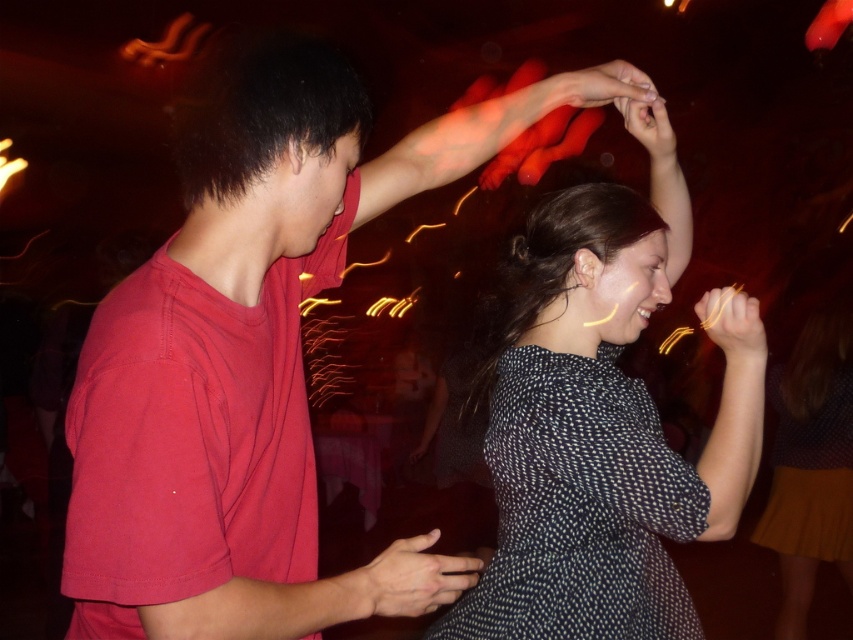
Which is in front, point (248, 468) or point (506, 564)?

Positioned in front is point (248, 468).

Does matte red t-shirt at left lie in front of dark blue dotted dress at center?

Yes, matte red t-shirt at left is in front of dark blue dotted dress at center.

Between point (183, 225) and point (641, 410), which one is positioned behind?

The point (641, 410) is behind.

This screenshot has width=853, height=640. Find the location of `matte red t-shirt at left`. matte red t-shirt at left is located at coordinates (245, 346).

Is the position of spotted fabric dress at center more distant than that of dark blue dotted dress at center?

Yes.

Between spotted fabric dress at center and dark blue dotted dress at center, which one has less height?

Standing shorter between the two is dark blue dotted dress at center.

Identify the location of spotted fabric dress at center. (601, 422).

Who is lower down, matte red t-shirt at left or matte black phone at center?

matte black phone at center

Which is behind, point (155, 362) or point (389, 604)?

Positioned behind is point (389, 604).

Locate an element on the screen. The width and height of the screenshot is (853, 640). matte red t-shirt at left is located at coordinates (245, 346).

Identify the location of matte red t-shirt at left. The image size is (853, 640). (245, 346).